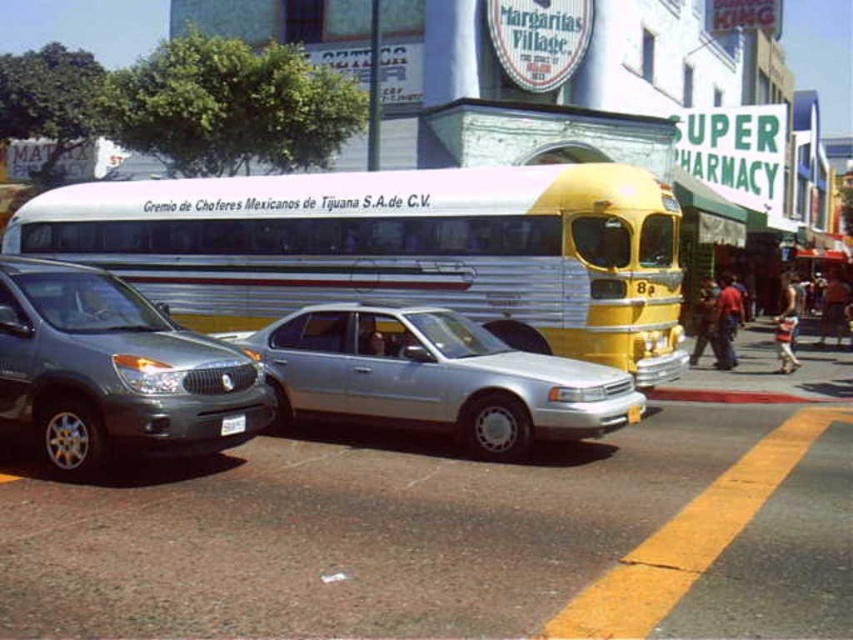
You are a delivery person trying to park your van in this area. You see the smooth concrete curb at lower right and the white plastic license plate at center. Which object is closer to you as you approach the curb?

The smooth concrete curb at lower right is closer to you because the white plastic license plate at center is behind it, meaning the curb is in front.

You are a delivery driver who needs to read the license plate of the silver metallic bus at center. Can you see the white plastic license plate at center from your current position in the vehicle?

The silver metallic bus at center is above the white plastic license plate at center, so yes, you can see the white plastic license plate at center from your current position in the vehicle.